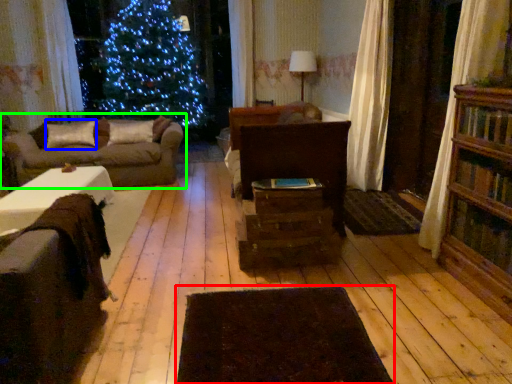
Question: Which object is positioned farthest from wide (highlighted by a red box)? Select from pillow (highlighted by a blue box) and studio couch (highlighted by a green box).

Choices:
 (A) pillow
 (B) studio couch

Answer: (A)